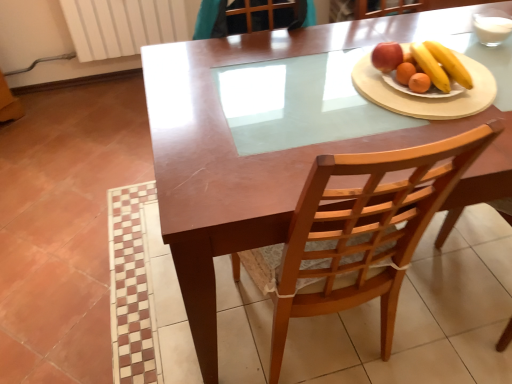
I want to click on free point behind white ceramic plate at upper right, so click(393, 29).